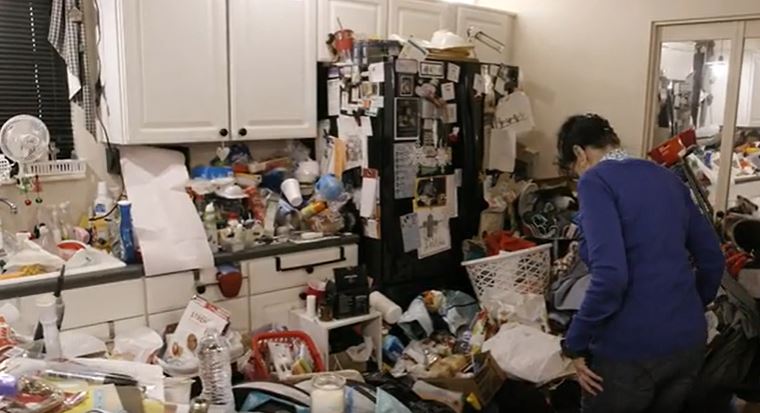
Find the location of a particular element. drawers is located at coordinates pyautogui.click(x=105, y=311), pyautogui.click(x=173, y=294), pyautogui.click(x=273, y=277).